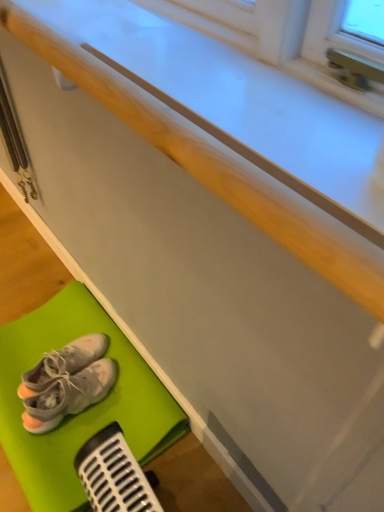
You are a GUI agent. You are given a task and a screenshot of the screen. Output one action in this format:
    pyautogui.click(x=<x>, y=<y>)
    Task: Click on the vacant area to the right of white fabric sneakers at lower left, which appears as the second footwear when viewed from the top
    Image resolution: width=384 pixels, height=512 pixels.
    Given the screenshot: What is the action you would take?
    pyautogui.click(x=131, y=403)